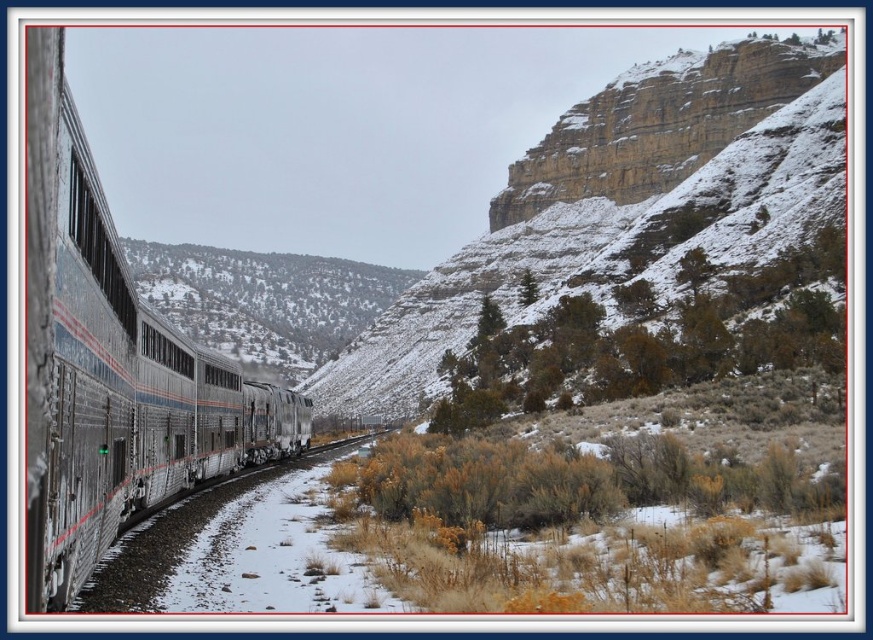
Question: Can you confirm if snowy rocky cliff at upper right is wider than silver metallic train at left?

Choices:
 (A) yes
 (B) no

Answer: (A)

Question: Which of the following is the closest to the observer?

Choices:
 (A) silver metallic train at left
 (B) snowy rocky cliff at upper right

Answer: (A)

Question: Can you confirm if snowy rocky cliff at upper right is positioned above silver metallic train at left?

Choices:
 (A) no
 (B) yes

Answer: (B)

Question: Which point is closer to the camera?

Choices:
 (A) pos(169,419)
 (B) pos(746,157)

Answer: (A)

Question: From the image, what is the correct spatial relationship of snowy rocky cliff at upper right in relation to silver metallic train at left?

Choices:
 (A) left
 (B) right

Answer: (B)